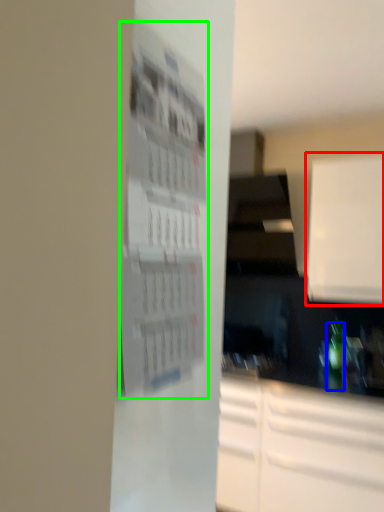
Question: Which is nearer to the cabinetry (highlighted by a red box)? bottle (highlighted by a blue box) or bulletin board (highlighted by a green box).

Choices:
 (A) bottle
 (B) bulletin board

Answer: (A)